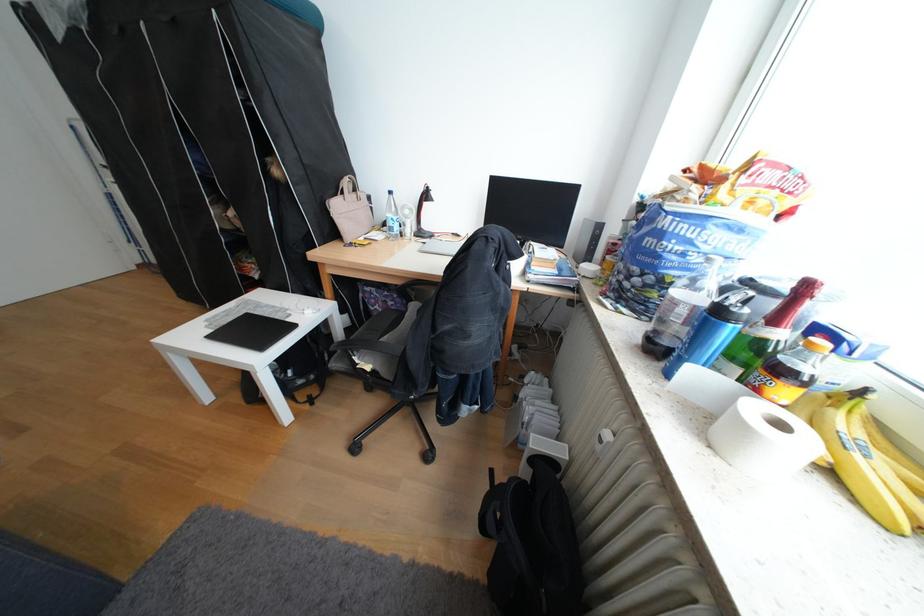
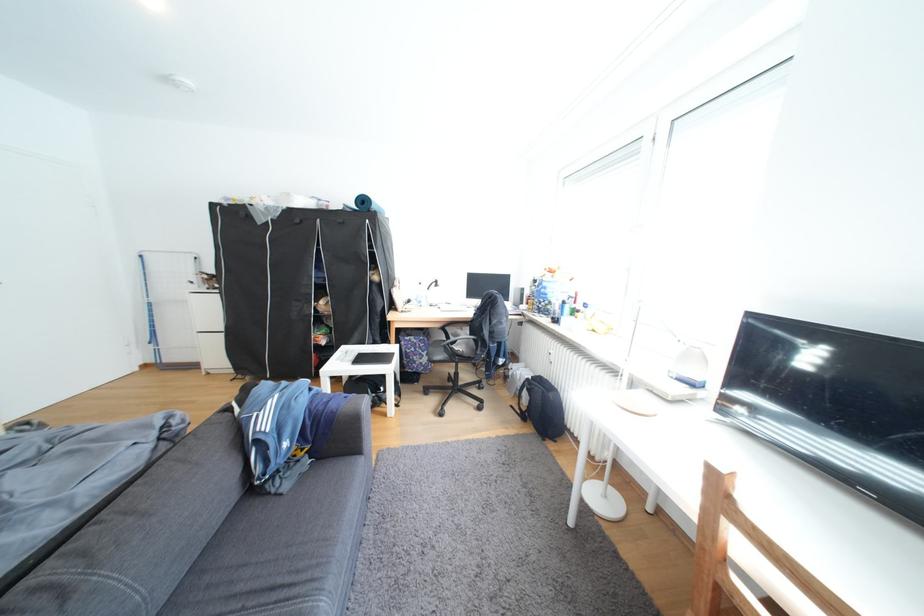
In the second image, find the point that corresponds to point 556,602 in the first image.

(564, 398)